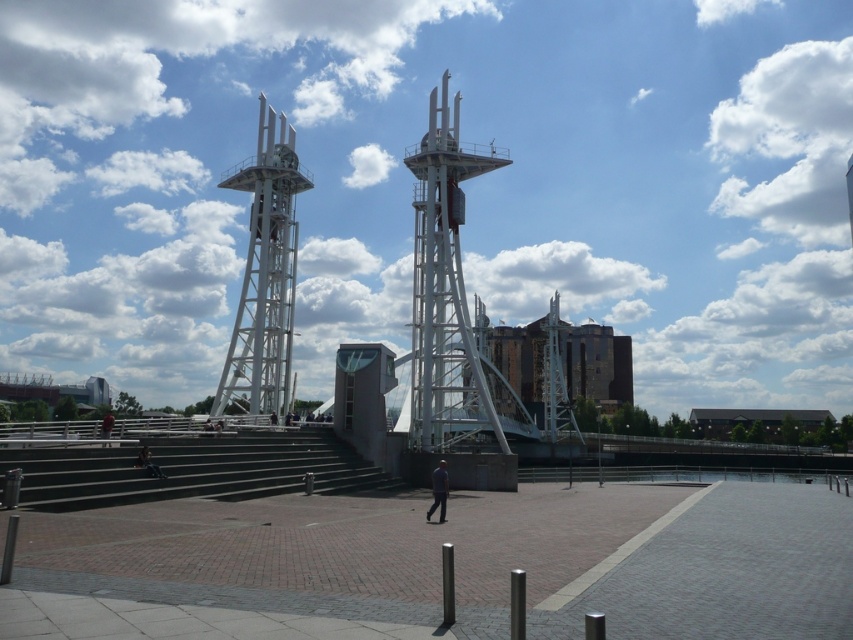
Question: Which object appears farthest from the camera in this image?

Choices:
 (A) dark gray fabric jacket at center
 (B) dark gray concrete stairs at center
 (C) white metallic tower at upper left

Answer: (C)

Question: Is dark gray fabric jacket at center above dark blue jeans at lower left?

Choices:
 (A) no
 (B) yes

Answer: (A)

Question: Estimate the real-world distances between objects in this image. Which object is farther from the dark gray concrete stairs at center?

Choices:
 (A) white metallic tower at upper left
 (B) white metallic tower at center

Answer: (A)

Question: Which object appears closest to the camera in this image?

Choices:
 (A) dark gray fabric jacket at center
 (B) dark blue jeans at lower left

Answer: (A)

Question: Can you confirm if dark gray fabric jacket at center is positioned above red fabric person at lower left?

Choices:
 (A) no
 (B) yes

Answer: (B)

Question: Can you confirm if white metallic tower at center is wider than white metallic tower at upper left?

Choices:
 (A) no
 (B) yes

Answer: (B)